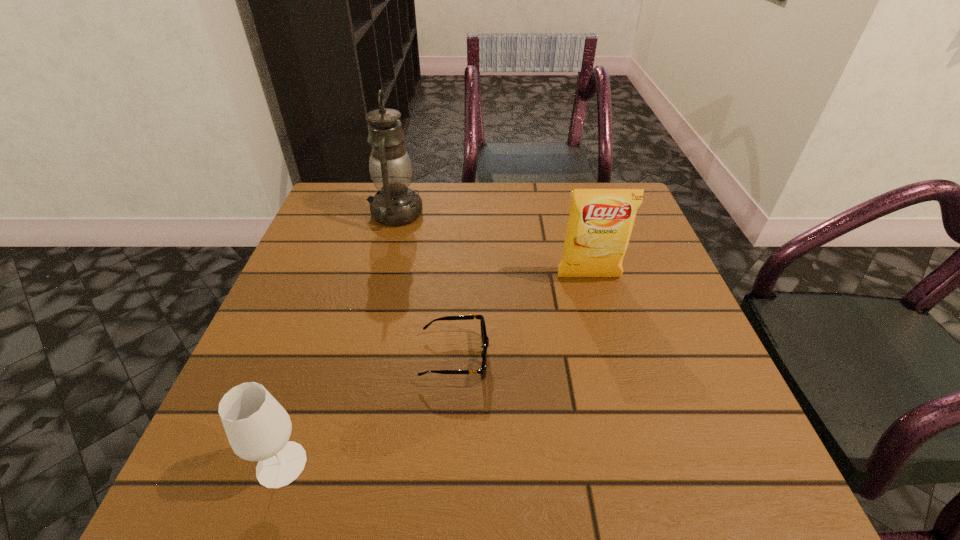
Find the location of a particular element. The width and height of the screenshot is (960, 540). the tallest object is located at coordinates (390, 167).

The width and height of the screenshot is (960, 540). Identify the location of the farthest object. (390, 167).

Identify the location of the third nearest object. (600, 223).

Find the location of a particular element. crisp (potato chip) is located at coordinates (600, 223).

Identify the location of the second shortest object. The width and height of the screenshot is (960, 540). (258, 428).

You are a GUI agent. You are given a task and a screenshot of the screen. Output one action in this format:
    pyautogui.click(x=<x>, y=<y>)
    Task: Click on the nearest object
    
    Given the screenshot: What is the action you would take?
    pyautogui.click(x=258, y=428)

Image resolution: width=960 pixels, height=540 pixels. I want to click on the shortest object, so click(x=485, y=340).

You are a GUI agent. You are given a task and a screenshot of the screen. Output one action in this format:
    pyautogui.click(x=<x>, y=<y>)
    Task: Click on the third object from left to right
    The height and width of the screenshot is (540, 960).
    Given the screenshot: What is the action you would take?
    pyautogui.click(x=485, y=340)

Locate an element on the screen. The width and height of the screenshot is (960, 540). free space located on the front of the tallest object is located at coordinates (359, 361).

In order to click on free space located on the front of the third shortest object with the logo in this screenshot , I will do `click(606, 338)`.